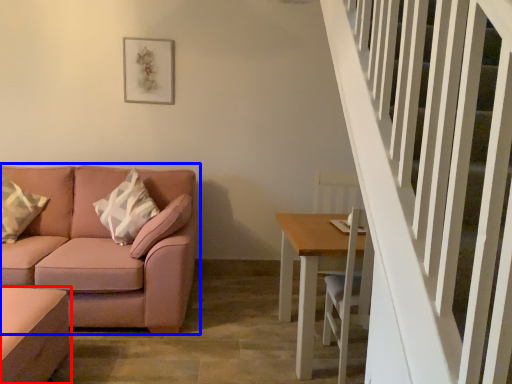
Question: Among these objects, which one is farthest to the camera, table (highlighted by a red box) or studio couch (highlighted by a blue box)?

Choices:
 (A) table
 (B) studio couch

Answer: (B)